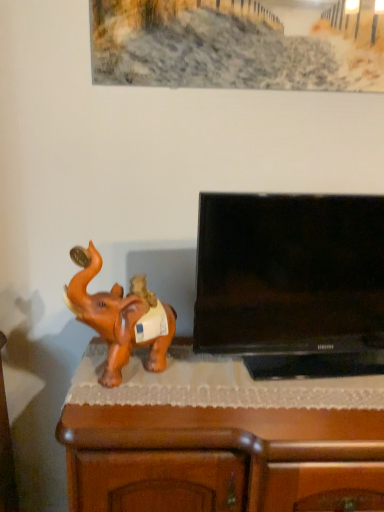
Question: From a real-world perspective, is brown glossy elephant at left under brown wood cabinet at lower left?

Choices:
 (A) yes
 (B) no

Answer: (B)

Question: Considering the relative positions of brown glossy elephant at left and brown wood cabinet at lower left in the image provided, is brown glossy elephant at left to the left of brown wood cabinet at lower left from the viewer's perspective?

Choices:
 (A) no
 (B) yes

Answer: (B)

Question: Is brown wood cabinet at lower left at the back of brown glossy elephant at left?

Choices:
 (A) yes
 (B) no

Answer: (B)

Question: Does brown glossy elephant at left lie behind brown wood cabinet at lower left?

Choices:
 (A) no
 (B) yes

Answer: (A)

Question: Considering the relative sizes of brown glossy elephant at left and brown wood cabinet at lower left in the image provided, is brown glossy elephant at left taller than brown wood cabinet at lower left?

Choices:
 (A) yes
 (B) no

Answer: (A)

Question: Based on their sizes in the image, would you say brown wood cabinet at lower left is bigger or smaller than brown glossy elephant at left?

Choices:
 (A) small
 (B) big

Answer: (B)

Question: In terms of width, does brown wood cabinet at lower left look wider or thinner when compared to brown glossy elephant at left?

Choices:
 (A) thin
 (B) wide

Answer: (B)

Question: In the image, is brown wood cabinet at lower left positioned in front of or behind brown glossy elephant at left?

Choices:
 (A) front
 (B) behind

Answer: (B)

Question: From a real-world perspective, is brown wood cabinet at lower left above or below brown glossy elephant at left?

Choices:
 (A) below
 (B) above

Answer: (A)

Question: Looking at their shapes, would you say black glossy flat-screen tv at right is wider or thinner than brown wood cabinet at lower left?

Choices:
 (A) wide
 (B) thin

Answer: (B)

Question: Based on their positions, is black glossy flat-screen tv at right located to the left or right of brown wood cabinet at lower left?

Choices:
 (A) right
 (B) left

Answer: (A)

Question: Does point (306, 245) appear closer or farther from the camera than point (180, 410)?

Choices:
 (A) closer
 (B) farther

Answer: (B)

Question: Considering the positions of black glossy flat-screen tv at right and brown wood cabinet at lower left in the image, is black glossy flat-screen tv at right bigger or smaller than brown wood cabinet at lower left?

Choices:
 (A) big
 (B) small

Answer: (B)

Question: Considering the positions of brown glossy elephant at left and black glossy flat-screen tv at right in the image, is brown glossy elephant at left bigger or smaller than black glossy flat-screen tv at right?

Choices:
 (A) big
 (B) small

Answer: (B)

Question: Considering their positions, is brown glossy elephant at left located in front of or behind black glossy flat-screen tv at right?

Choices:
 (A) front
 (B) behind

Answer: (A)